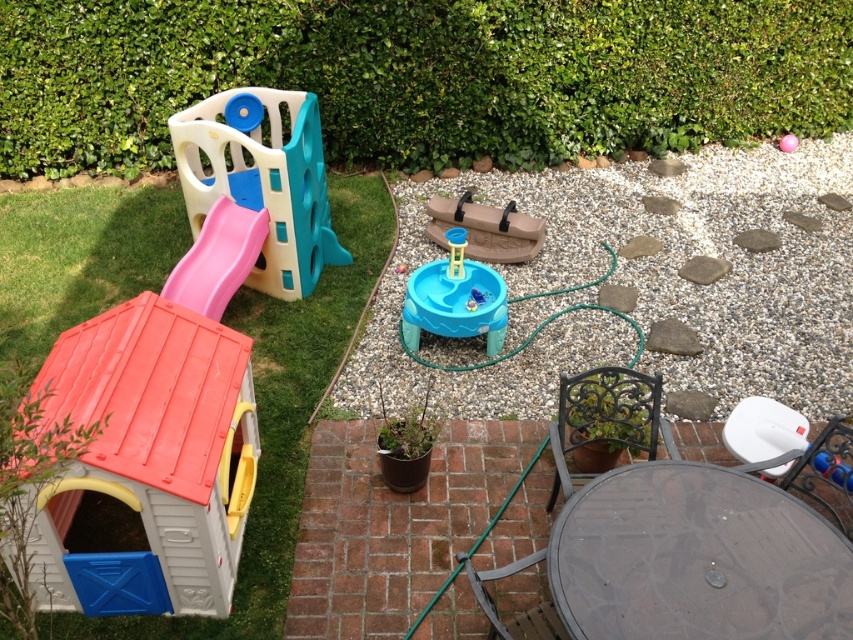
Can you confirm if black wrought iron chair at lower right is positioned to the left of white plastic chair at lower right?

Yes, black wrought iron chair at lower right is to the left of white plastic chair at lower right.

Does point (590, 444) lie in front of point (766, 406)?

No, (590, 444) is behind (766, 406).

At what (x,y) coordinates should I click in order to perform the action: click on black wrought iron chair at lower right. Please return your answer as a coordinate pair (x, y). The image size is (853, 640). Looking at the image, I should click on (602, 419).

Is blue plastic water table at center thinner than metallic dark brown chair at lower center?

Incorrect, blue plastic water table at center's width is not less than metallic dark brown chair at lower center's.

Which of these two, blue plastic water table at center or metallic dark brown chair at lower center, stands shorter?

metallic dark brown chair at lower center

Who is more distant from viewer, (466, 292) or (520, 561)?

The point (466, 292) is more distant.

Find the location of a particular element. blue plastic water table at center is located at coordinates (456, 298).

Can you confirm if green leafy hedge at upper left is wider than plastic playhouse at left?

Correct, the width of green leafy hedge at upper left exceeds that of plastic playhouse at left.

This screenshot has width=853, height=640. Identify the location of green leafy hedge at upper left. (421, 74).

Where is `green leafy hedge at upper left`? green leafy hedge at upper left is located at coordinates (421, 74).